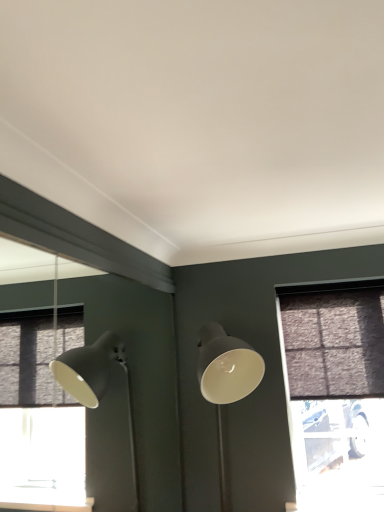
Question: From the image's perspective, would you say matte gray lamp at center is shown under brown textured curtain at right?

Choices:
 (A) yes
 (B) no

Answer: (A)

Question: Does matte gray lamp at center have a lesser width compared to brown textured curtain at right?

Choices:
 (A) no
 (B) yes

Answer: (A)

Question: Is matte gray lamp at center beside brown textured curtain at right?

Choices:
 (A) yes
 (B) no

Answer: (B)

Question: Is matte gray lamp at center at the right side of brown textured curtain at right?

Choices:
 (A) yes
 (B) no

Answer: (B)

Question: Could you tell me if matte gray lamp at center is turned towards brown textured curtain at right?

Choices:
 (A) yes
 (B) no

Answer: (B)

Question: Considering the positions of textured dark gray window at right and brown textured curtain at right in the image, is textured dark gray window at right taller or shorter than brown textured curtain at right?

Choices:
 (A) short
 (B) tall

Answer: (B)

Question: Based on their sizes in the image, would you say textured dark gray window at right is bigger or smaller than brown textured curtain at right?

Choices:
 (A) big
 (B) small

Answer: (A)

Question: Looking at their shapes, would you say textured dark gray window at right is wider or thinner than brown textured curtain at right?

Choices:
 (A) thin
 (B) wide

Answer: (A)

Question: Is point (317, 309) positioned closer to the camera than point (322, 301)?

Choices:
 (A) farther
 (B) closer

Answer: (B)

Question: From the image's perspective, is brown textured curtain at right located above or below textured dark gray window at right?

Choices:
 (A) below
 (B) above

Answer: (B)

Question: Do you think brown textured curtain at right is within textured dark gray window at right, or outside of it?

Choices:
 (A) inside
 (B) outside

Answer: (B)

Question: Based on their sizes in the image, would you say brown textured curtain at right is bigger or smaller than textured dark gray window at right?

Choices:
 (A) big
 (B) small

Answer: (B)

Question: From a real-world perspective, relative to textured dark gray window at right, is brown textured curtain at right vertically above or below?

Choices:
 (A) above
 (B) below

Answer: (A)

Question: Considering the relative positions of matte gray lamp at center and brown textured curtain at right in the image provided, is matte gray lamp at center to the left or to the right of brown textured curtain at right?

Choices:
 (A) left
 (B) right

Answer: (A)

Question: From a real-world perspective, is matte gray lamp at center positioned above or below brown textured curtain at right?

Choices:
 (A) below
 (B) above

Answer: (A)